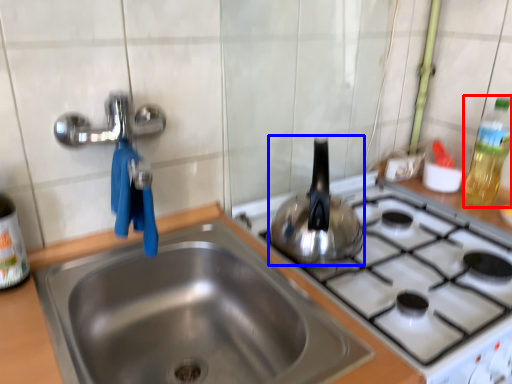
Question: Which of the following is the closest to the observer, bottle (highlighted by a red box) or tea pot (highlighted by a blue box)?

Choices:
 (A) bottle
 (B) tea pot

Answer: (B)